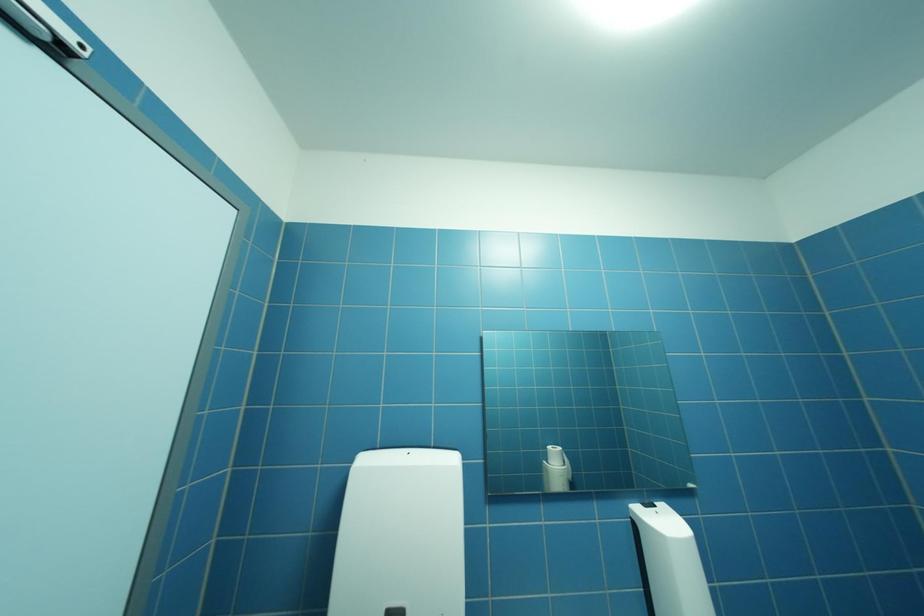
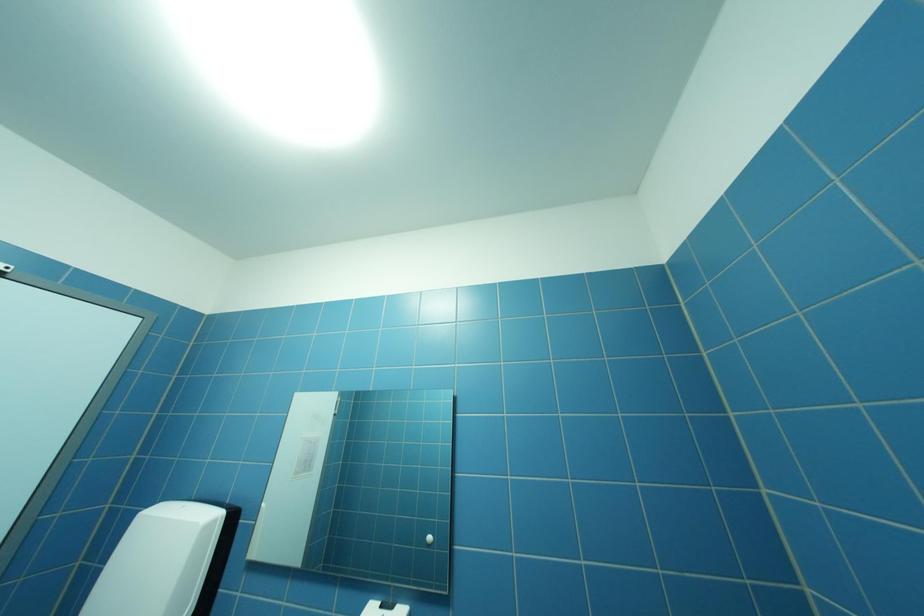
Question: Which direction would the cameraman need to move to produce the second image? Reply with the corresponding letter.

Choices:
 (A) Left
 (B) Right
 (C) Forward
 (D) Backward

Answer: (B)